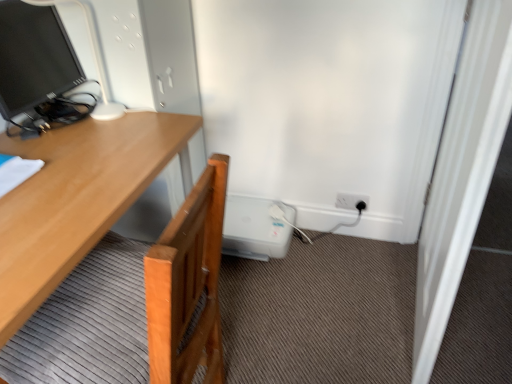
This screenshot has height=384, width=512. What are the coordinates of `vacant space to the left of white wooden screen door at right` in the screenshot? It's located at (322, 311).